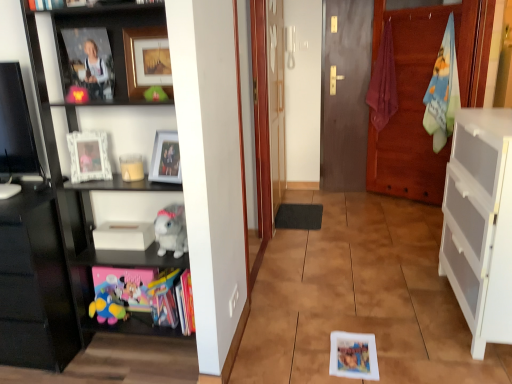
At what (x,y) coordinates should I click in order to perform the action: click on vacant region in front of black glossy shelf at left. Please return your answer as a coordinate pair (x, y). Looking at the image, I should click on (139, 365).